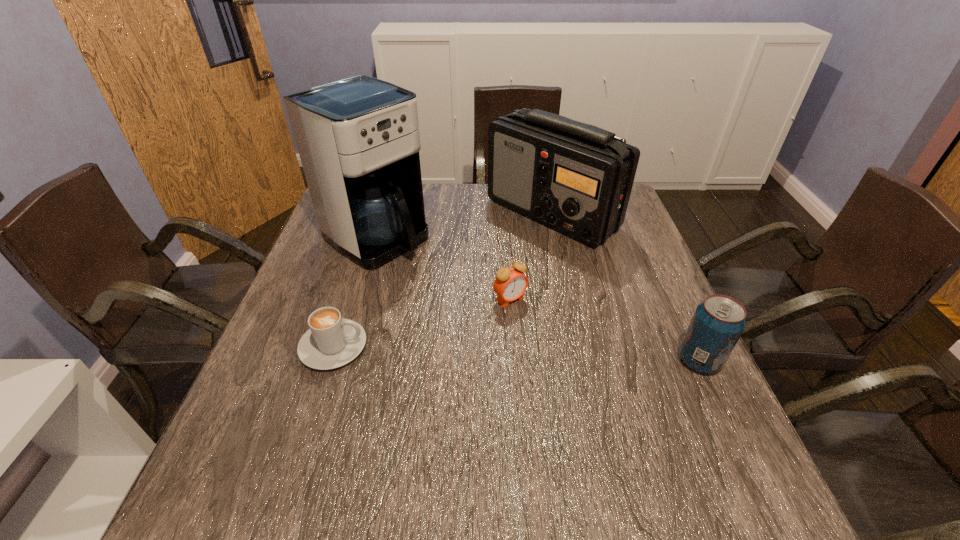
At what (x,y) coordinates should I click in order to perform the action: click on cappuccino located at the left edge. Please return your answer as a coordinate pair (x, y). Image resolution: width=960 pixels, height=540 pixels. Looking at the image, I should click on (332, 341).

Identify the location of coffee maker that is positioned at the left edge. (358, 139).

This screenshot has width=960, height=540. In order to click on pop soda located in the right edge section of the desktop in this screenshot , I will do `click(718, 322)`.

At what (x,y) coordinates should I click in order to perform the action: click on radio receiver that is at the right edge. Please return your answer as a coordinate pair (x, y). This screenshot has width=960, height=540. Looking at the image, I should click on (576, 178).

You are a GUI agent. You are given a task and a screenshot of the screen. Output one action in this format:
    pyautogui.click(x=<x>, y=<y>)
    Task: Click on the object present at the far left corner
    Image resolution: width=960 pixels, height=540 pixels.
    Given the screenshot: What is the action you would take?
    pyautogui.click(x=358, y=139)

Identify the location of object situated at the far right corner. This screenshot has height=540, width=960. (576, 178).

Identify the location of vacant space at the far edge of the desktop. (435, 203).

At what (x,y) coordinates should I click in order to perform the action: click on free space at the near edge of the desktop. Please return your answer as a coordinate pair (x, y). The width and height of the screenshot is (960, 540). Looking at the image, I should click on (424, 443).

What are the coordinates of `vacant area at the left edge of the desktop` in the screenshot? It's located at (338, 262).

Where is `free space at the right edge of the desktop`? This screenshot has height=540, width=960. free space at the right edge of the desktop is located at coordinates pyautogui.click(x=590, y=255).